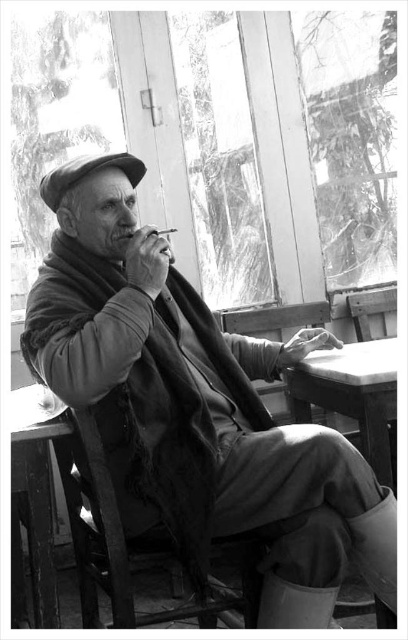
Question: Is soft wool scarf at center closer to the viewer compared to smooth paper cigarette at center?

Choices:
 (A) yes
 (B) no

Answer: (A)

Question: Can you confirm if soft wool scarf at center is bigger than transparent glass window at upper center?

Choices:
 (A) yes
 (B) no

Answer: (B)

Question: Which of the following is the farthest from the observer?

Choices:
 (A) (75, 115)
 (B) (328, 356)
 (C) (172, 228)

Answer: (C)

Question: Among these points, which one is farthest from the camera?

Choices:
 (A) (113, 160)
 (B) (383, 400)

Answer: (A)

Question: Does wooden chair at lower left lie behind flat felt hat at center?

Choices:
 (A) yes
 (B) no

Answer: (B)

Question: Based on their relative distances, which object is farther from the soft wool scarf at center?

Choices:
 (A) flat felt hat at center
 (B) smooth wooden table at lower center
 (C) transparent glass window at upper center

Answer: (C)